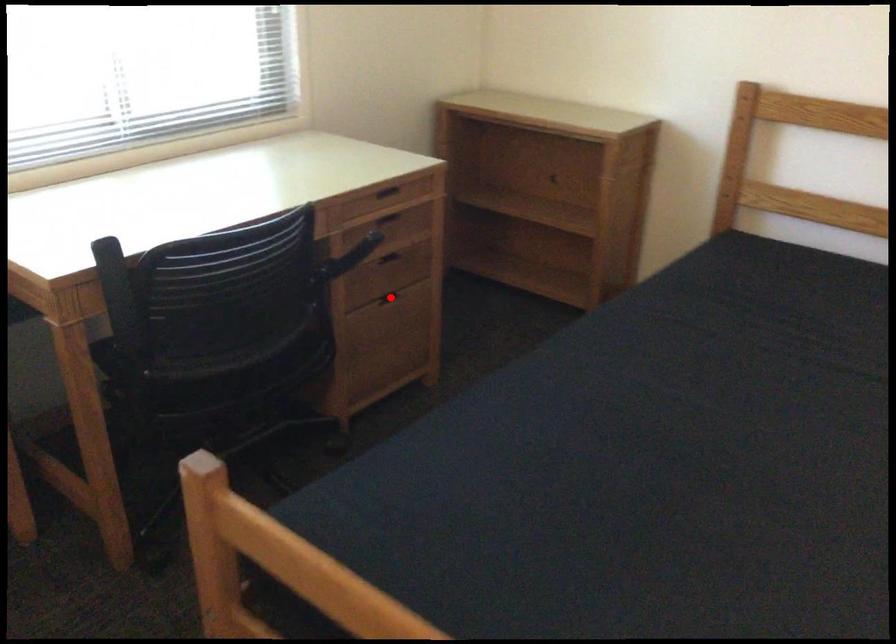
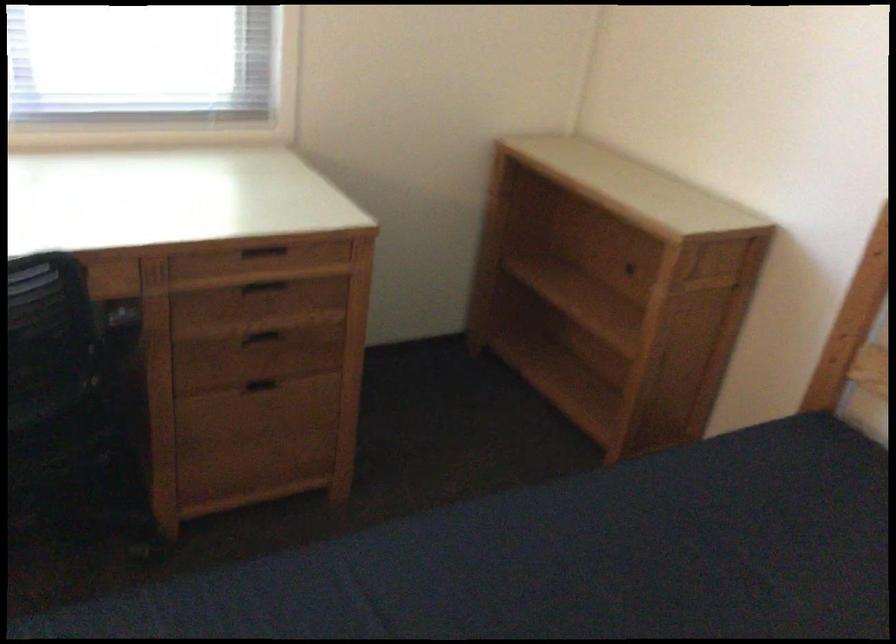
Question: I am providing you with two images of the same scene from different viewpoints. Given a red point in image1, look at the same physical point in image2. Is it:

Choices:
 (A) Closer to the viewpoint
 (B) Farther from the viewpoint

Answer: (A)